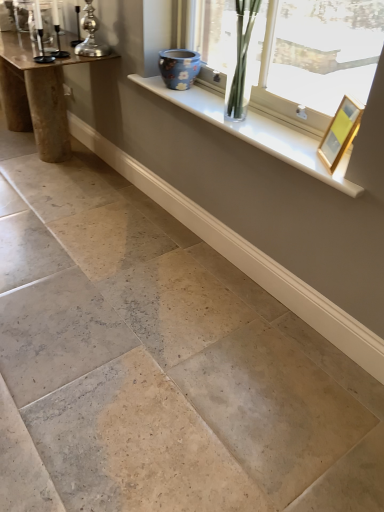
What are the coordinates of `vacant location below blue floral ceramic vase at upper center (from a real-world perspective)` in the screenshot? It's located at (171, 87).